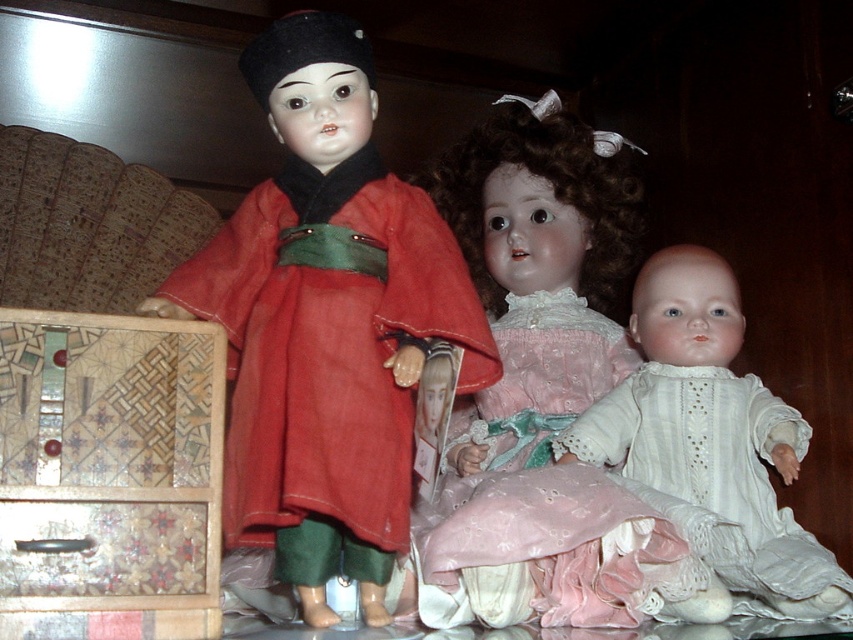
Question: Observing the image, what is the correct spatial positioning of pink lace dress at center in reference to wooden drawer at lower left?

Choices:
 (A) above
 (B) below

Answer: (A)

Question: Is white lace dress at center to the left of wooden drawer at lower left from the viewer's perspective?

Choices:
 (A) no
 (B) yes

Answer: (A)

Question: Which object is positioned farthest from the matte red kimono at center?

Choices:
 (A) wooden mosaic drawer at lower left
 (B) wooden drawer at lower left
 (C) white lace dress at center

Answer: (C)

Question: Is pink lace dress at center to the right of wooden mosaic drawer at lower left from the viewer's perspective?

Choices:
 (A) yes
 (B) no

Answer: (A)

Question: Which of these objects is positioned closest to the white lace dress at center?

Choices:
 (A) matte red kimono at center
 (B) pink lace dress at center
 (C) wooden mosaic drawer at lower left

Answer: (B)

Question: Which point is closer to the camera taking this photo?

Choices:
 (A) (788, 440)
 (B) (587, 588)
 (C) (299, 376)
 (D) (91, 566)

Answer: (D)